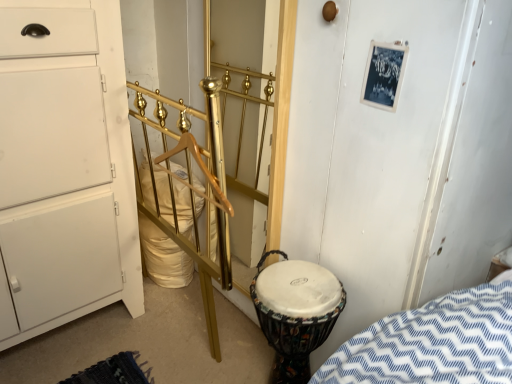
Question: From the image's perspective, does gold metallic door at center appear higher than gold polished metal rail at center?

Choices:
 (A) no
 (B) yes

Answer: (B)

Question: Is gold metallic door at center not close to gold polished metal rail at center?

Choices:
 (A) no
 (B) yes

Answer: (A)

Question: Is gold metallic door at center positioned in front of gold polished metal rail at center?

Choices:
 (A) yes
 (B) no

Answer: (B)

Question: From a real-world perspective, is gold metallic door at center beneath gold polished metal rail at center?

Choices:
 (A) no
 (B) yes

Answer: (A)

Question: Is gold metallic door at center facing away from gold polished metal rail at center?

Choices:
 (A) yes
 (B) no

Answer: (A)

Question: Visually, is white matte chest of drawers at left positioned to the left or to the right of gold metallic door at center?

Choices:
 (A) right
 (B) left

Answer: (B)

Question: Is white matte chest of drawers at left spatially inside gold metallic door at center, or outside of it?

Choices:
 (A) outside
 (B) inside

Answer: (A)

Question: Relative to gold metallic door at center, is white matte chest of drawers at left in front or behind?

Choices:
 (A) behind
 (B) front

Answer: (B)

Question: Is point (41, 145) positioned closer to the camera than point (261, 231)?

Choices:
 (A) farther
 (B) closer

Answer: (B)

Question: Choose the correct answer: Is gold polished metal rail at center inside white matte chest of drawers at left or outside it?

Choices:
 (A) inside
 (B) outside

Answer: (B)

Question: From a real-world perspective, is gold polished metal rail at center above or below white matte chest of drawers at left?

Choices:
 (A) below
 (B) above

Answer: (A)

Question: In the image, is gold polished metal rail at center on the left side or the right side of white matte chest of drawers at left?

Choices:
 (A) left
 (B) right

Answer: (B)

Question: Considering the positions of point pos(221,139) and point pos(6,48), is point pos(221,139) closer or farther from the camera than point pos(6,48)?

Choices:
 (A) closer
 (B) farther

Answer: (B)

Question: From a real-world perspective, is gold polished metal rail at center positioned above or below multicolored fabric drum at lower right?

Choices:
 (A) below
 (B) above

Answer: (B)

Question: Is point (179, 246) positioned closer to the camera than point (273, 271)?

Choices:
 (A) closer
 (B) farther

Answer: (B)